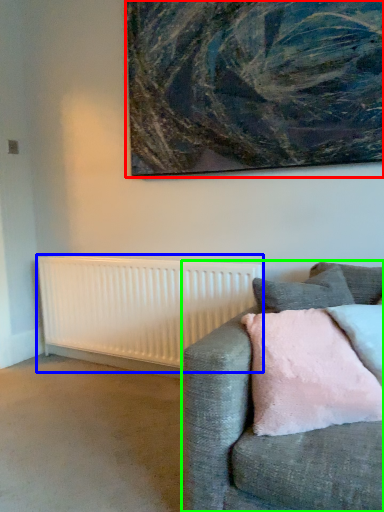
Question: Considering the real-world distances, which object is closest to picture frame (highlighted by a red box)? radiator (highlighted by a blue box) or studio couch (highlighted by a green box).

Choices:
 (A) radiator
 (B) studio couch

Answer: (A)